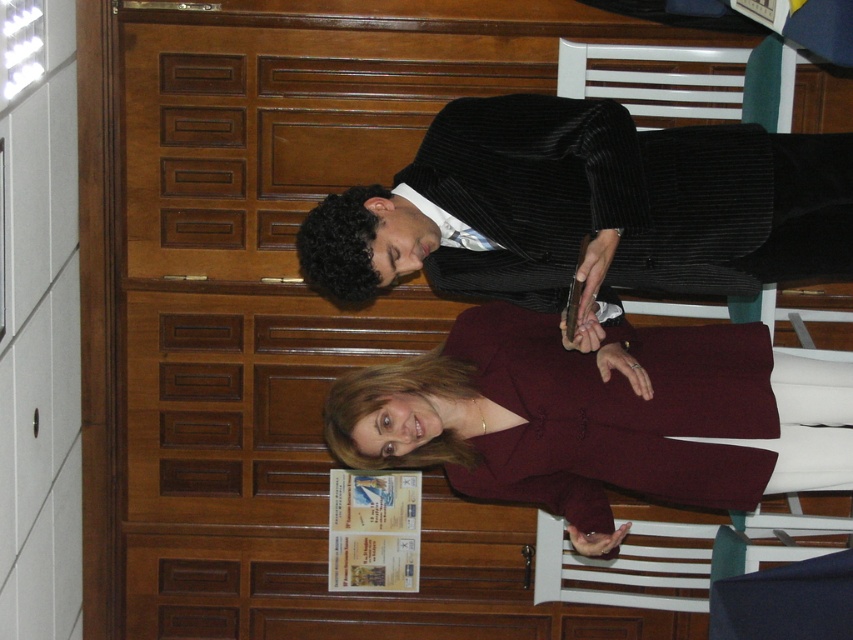
Question: Is burgundy fabric coat at center to the right of white plastic chair at center from the viewer's perspective?

Choices:
 (A) no
 (B) yes

Answer: (A)

Question: Considering the real-world distances, which object is farthest from the black corduroy suit at center?

Choices:
 (A) white plastic chair at center
 (B) burgundy fabric coat at center

Answer: (A)

Question: Does burgundy fabric coat at center appear on the left side of white plastic chair at center?

Choices:
 (A) yes
 (B) no

Answer: (A)

Question: Which object appears closest to the camera in this image?

Choices:
 (A) black corduroy suit at center
 (B) white plastic chair at center

Answer: (A)

Question: Can you confirm if burgundy fabric coat at center is positioned below white plastic chair at center?

Choices:
 (A) no
 (B) yes

Answer: (A)

Question: Which point is closer to the camera?

Choices:
 (A) (636, 45)
 (B) (434, 396)
 (C) (759, 250)

Answer: (C)